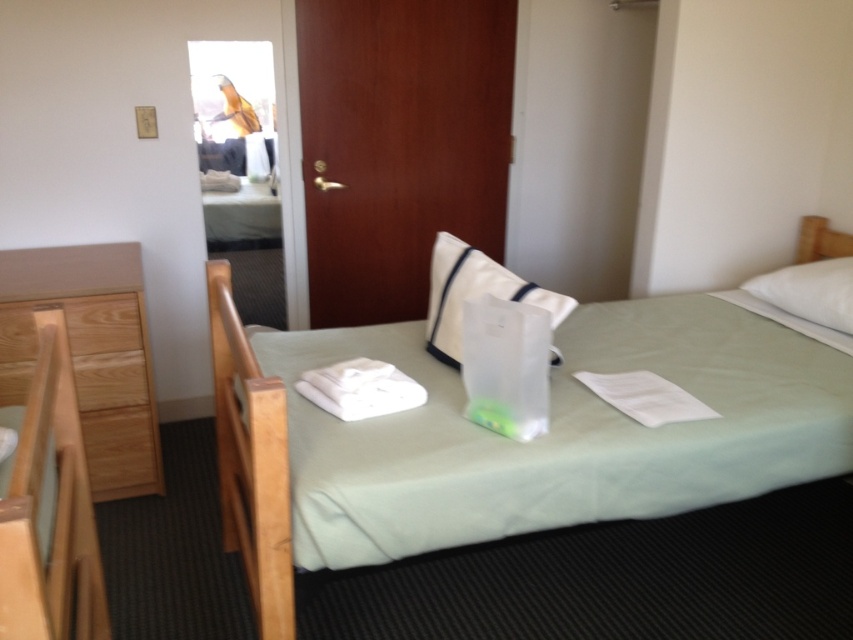
Between light brown wood dresser at left and white fabric pillow at center, which one is positioned higher?

white fabric pillow at center is above.

This screenshot has width=853, height=640. What do you see at coordinates (90, 353) in the screenshot? I see `light brown wood dresser at left` at bounding box center [90, 353].

Where is `light brown wood dresser at left`? light brown wood dresser at left is located at coordinates (90, 353).

What are the coordinates of `light brown wood dresser at left` in the screenshot? It's located at (90, 353).

Looking at this image, does white fabric pillow at center lie in front of white soft pillow at upper right?

Yes, it is.

Is point (453, 355) more distant than point (827, 269)?

No, it is in front of (827, 269).

This screenshot has width=853, height=640. What do you see at coordinates (474, 292) in the screenshot?
I see `white fabric pillow at center` at bounding box center [474, 292].

You are a GUI agent. You are given a task and a screenshot of the screen. Output one action in this format:
    pyautogui.click(x=<x>, y=<y>)
    Task: Click on the white fabric pillow at center
    The height and width of the screenshot is (640, 853).
    Given the screenshot: What is the action you would take?
    pyautogui.click(x=474, y=292)

Who is more forward, (840,244) or (512,285)?

Positioned in front is point (512,285).

The image size is (853, 640). Identify the location of green fabric bed at center. (252, 461).

What do you see at coordinates (252, 461) in the screenshot? I see `green fabric bed at center` at bounding box center [252, 461].

Locate an element on the screen. This screenshot has width=853, height=640. green fabric bed at center is located at coordinates (252, 461).